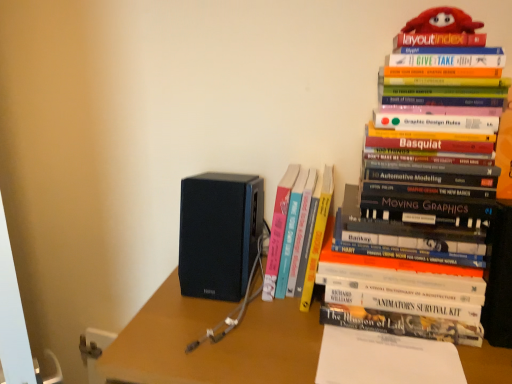
Question: Does hardcover book at upper right, arranged as the first book when viewed from the right, have a lesser height compared to white paper at center?

Choices:
 (A) yes
 (B) no

Answer: (B)

Question: Is hardcover book at upper right, arranged as the first book when viewed from the right, behind white paper at center?

Choices:
 (A) no
 (B) yes

Answer: (A)

Question: Is hardcover book at upper right, the 2th book viewed from the left, far away from white paper at center?

Choices:
 (A) yes
 (B) no

Answer: (B)

Question: Is hardcover book at upper right, arranged as the first book when viewed from the right, in contact with white paper at center?

Choices:
 (A) yes
 (B) no

Answer: (B)

Question: Is hardcover book at upper right, arranged as the first book when viewed from the right, smaller than white paper at center?

Choices:
 (A) yes
 (B) no

Answer: (B)

Question: Is hardcover book at upper right, arranged as the first book when viewed from the right, bigger than white paper at center?

Choices:
 (A) no
 (B) yes

Answer: (B)

Question: Is white paper at center further to the viewer compared to matte black speaker at center?

Choices:
 (A) no
 (B) yes

Answer: (B)

Question: Considering the relative sizes of white paper at center and matte black speaker at center in the image provided, is white paper at center smaller than matte black speaker at center?

Choices:
 (A) no
 (B) yes

Answer: (B)

Question: Does white paper at center come in front of matte black speaker at center?

Choices:
 (A) yes
 (B) no

Answer: (B)

Question: Considering the relative sizes of white paper at center and matte black speaker at center in the image provided, is white paper at center taller than matte black speaker at center?

Choices:
 (A) no
 (B) yes

Answer: (A)

Question: Is white paper at center oriented away from matte black speaker at center?

Choices:
 (A) no
 (B) yes

Answer: (A)

Question: From a real-world perspective, does white paper at center stand above matte black speaker at center?

Choices:
 (A) yes
 (B) no

Answer: (A)

Question: Is white paper at center positioned behind hardcover book at upper right, the 2th book viewed from the left?

Choices:
 (A) yes
 (B) no

Answer: (A)